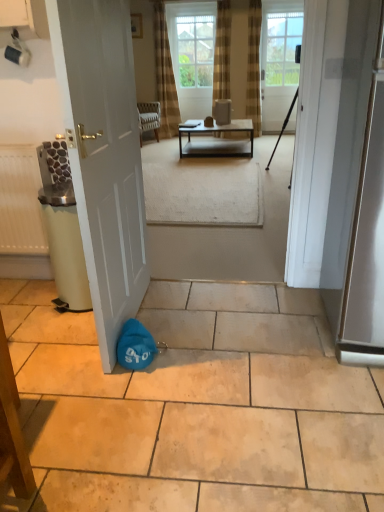
Question: Considering the positions of brown textured curtain at upper center and clear glass window screen at upper center in the image, is brown textured curtain at upper center taller or shorter than clear glass window screen at upper center?

Choices:
 (A) short
 (B) tall

Answer: (B)

Question: From the image's perspective, relative to clear glass window screen at upper center, is brown textured curtain at upper center above or below?

Choices:
 (A) below
 (B) above

Answer: (A)

Question: Considering the real-world distances, which object is closest to the white glass door at upper center, the 2th door ordered from the bottom?

Choices:
 (A) matte blue bag at lower left
 (B) matte white coffee cup at upper left
 (C) metallic silver screen door at right
 (D) clear glass window screen at upper center
 (E) matte white radiator at left

Answer: (D)

Question: Which object is positioned farthest from the matte blue bag at lower left?

Choices:
 (A) clear glass window screen at upper center
 (B) white matte door at left, which is counted as the second door, starting from the top
 (C) brown textured curtain at upper center
 (D) matte white coffee cup at upper left
 (E) matte white radiator at left

Answer: (A)